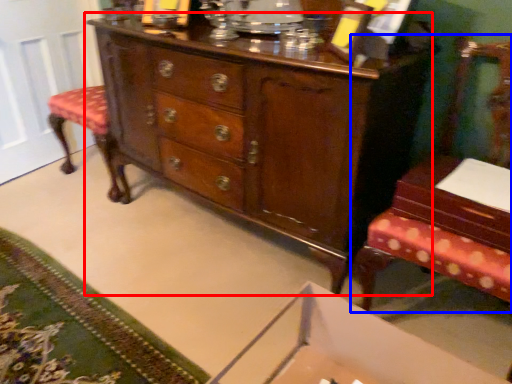
Question: Which object appears closest to the camera in this image, chest of drawers (highlighted by a red box) or furniture (highlighted by a blue box)?

Choices:
 (A) chest of drawers
 (B) furniture

Answer: (B)